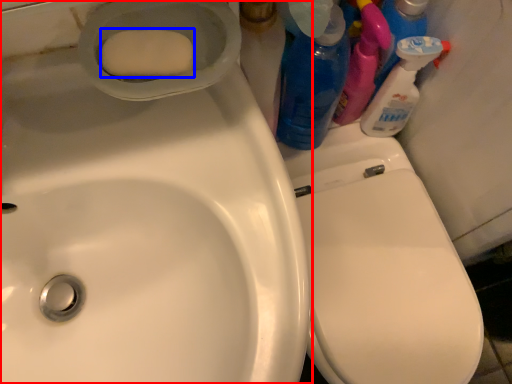
Question: Among these objects, which one is farthest to the camera, sink (highlighted by a red box) or soap (highlighted by a blue box)?

Choices:
 (A) sink
 (B) soap

Answer: (B)